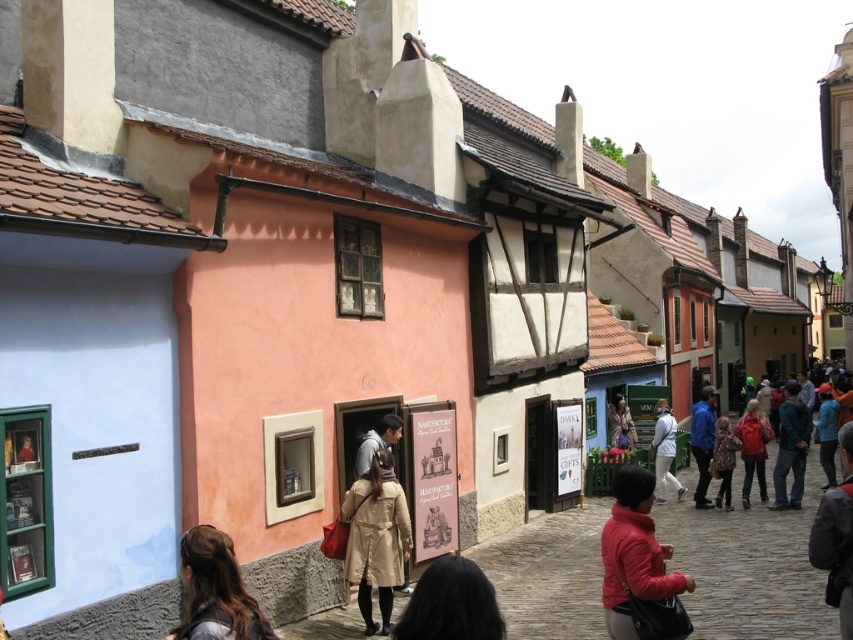
Question: Among these points, which one is farthest from the camera?

Choices:
 (A) (386, 465)
 (B) (459, 564)

Answer: (A)

Question: Among these objects, which one is farthest from the camera?

Choices:
 (A) floral-patterned coat at center
 (B) blue matte jacket at center
 (C) blue fabric jacket at right

Answer: (C)

Question: Is matte red jacket at lower center above beige fabric trench coat at center?

Choices:
 (A) yes
 (B) no

Answer: (A)

Question: Does blue denim jacket at lower right appear over blue matte jacket at center?

Choices:
 (A) yes
 (B) no

Answer: (A)

Question: Which point is farther from the camera taking this photo?

Choices:
 (A) (448, 561)
 (B) (370, 531)
 (C) (796, 472)

Answer: (C)

Question: Can you confirm if red backpack at center is positioned below leather jacket at center?

Choices:
 (A) yes
 (B) no

Answer: (A)